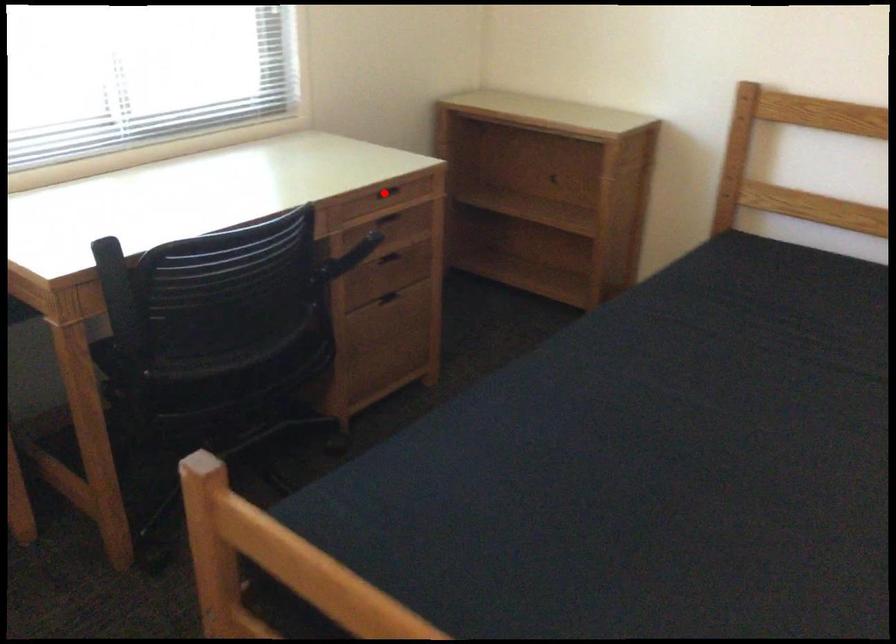
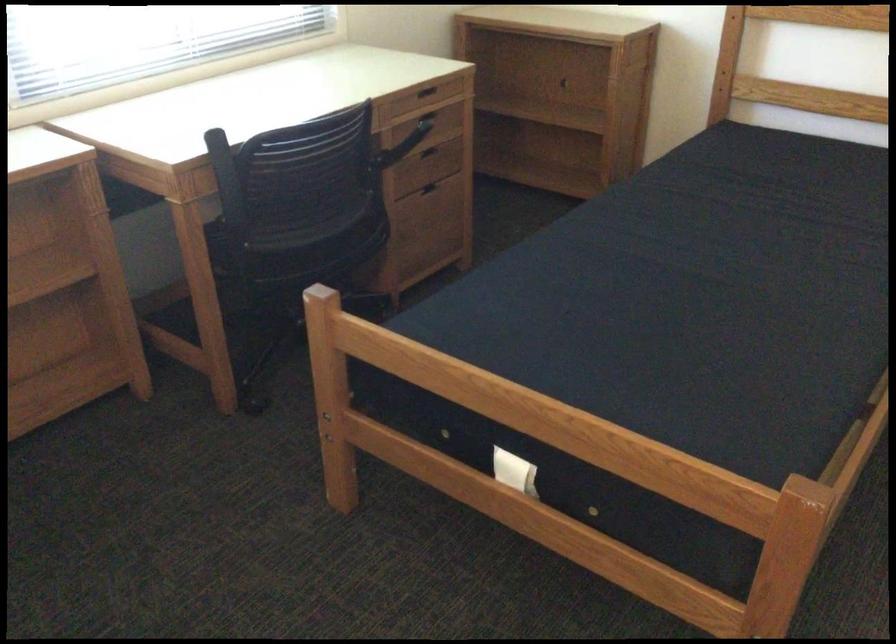
Question: A red point is marked in image1. In image2, is the corresponding 3D point closer to the camera or farther? Reply with the corresponding letter.

Choices:
 (A) The corresponding 3D point is closer.
 (B) The corresponding 3D point is farther.

Answer: (B)